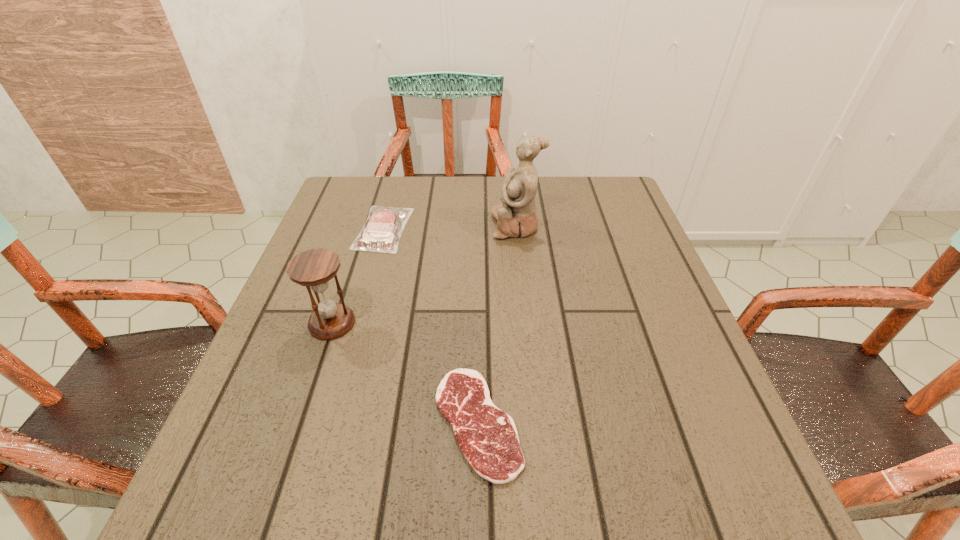
The width and height of the screenshot is (960, 540). Find the location of `vacant area at the left edge of the desktop`. vacant area at the left edge of the desktop is located at coordinates (289, 337).

Where is `vacant space at the right edge of the desktop`? Image resolution: width=960 pixels, height=540 pixels. vacant space at the right edge of the desktop is located at coordinates (622, 342).

Locate an element on the screen. This screenshot has width=960, height=540. free space at the far left corner is located at coordinates (354, 188).

This screenshot has width=960, height=540. In the image, there is a desktop. What are the coordinates of `vacant area at the near left corner` in the screenshot? It's located at (223, 490).

Identify the location of vacant area at the far right corner of the desktop. The width and height of the screenshot is (960, 540). pos(583,190).

Locate an element on the screen. The height and width of the screenshot is (540, 960). free space between the figurine and the right steak is located at coordinates (497, 325).

Locate an element on the screen. This screenshot has height=540, width=960. empty space that is in between the tallest object and the third farthest object is located at coordinates (424, 274).

At what (x,y) coordinates should I click in order to perform the action: click on empty space between the figurine and the taller steak. Please return your answer as a coordinate pair (x, y). Looking at the image, I should click on (450, 227).

The image size is (960, 540). In order to click on vacant space that is in between the tallest object and the nearest object in this screenshot , I will do `click(497, 325)`.

This screenshot has width=960, height=540. In order to click on free spot between the shortest object and the farther steak in this screenshot , I will do `click(431, 326)`.